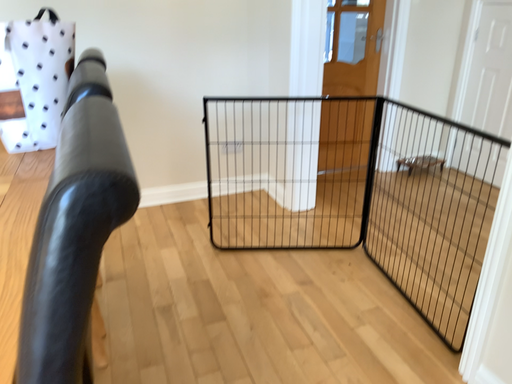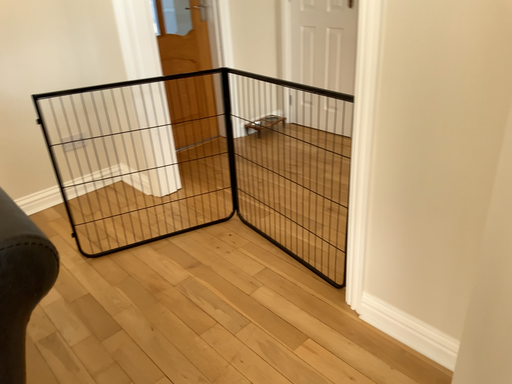
Question: How did the camera likely rotate when shooting the video?

Choices:
 (A) rotated right
 (B) rotated left

Answer: (A)